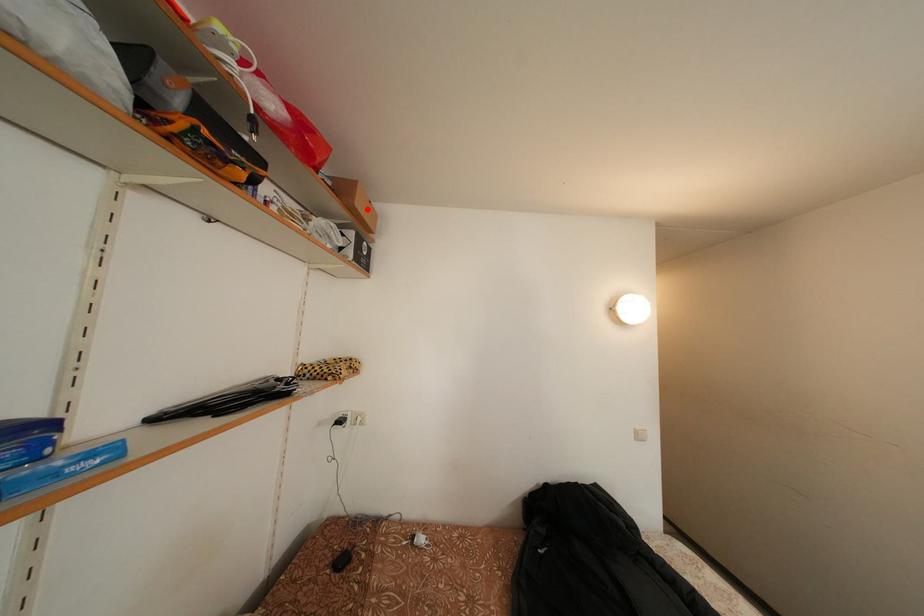
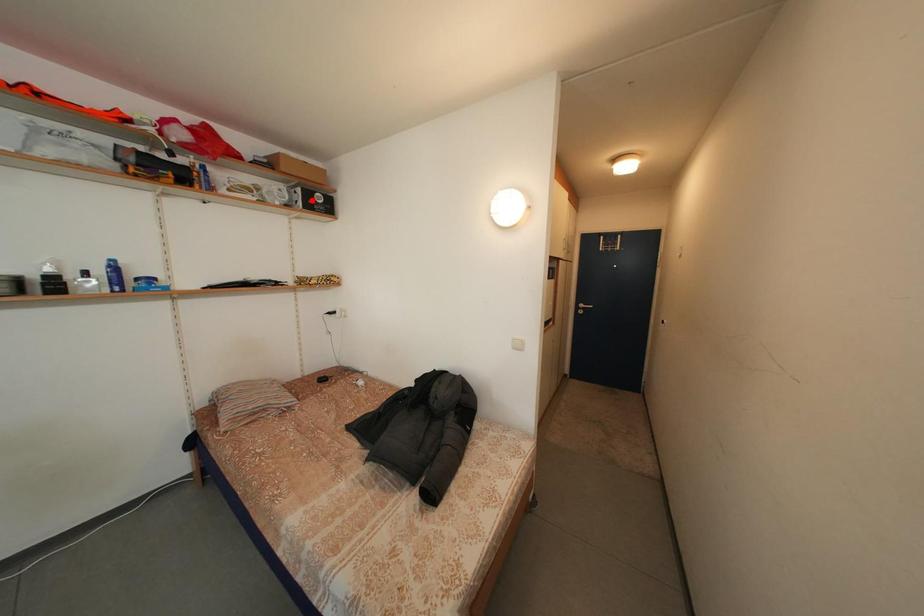
I am providing you with two images of the same scene from different viewpoints. A red point is marked on the first image and another point is marked on the second image. Is the marked point in image1 the same physical position as the marked point in image2?

No